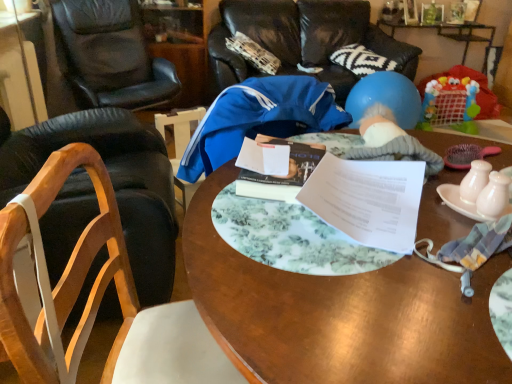
Question: Does wooden chair at left, the second chair in the front-to-back sequence, have a smaller size compared to blue fabric chair at upper center, the 4th chair from the front?

Choices:
 (A) yes
 (B) no

Answer: (A)

Question: Can blue fabric chair at upper center, the 4th chair from the front, be found inside wooden chair at left, the second chair in the front-to-back sequence?

Choices:
 (A) yes
 (B) no

Answer: (B)

Question: Is wooden chair at left, positioned as the 3th chair in back-to-front order, shorter than blue fabric chair at upper center, the 4th chair from the front?

Choices:
 (A) no
 (B) yes

Answer: (A)

Question: Does wooden chair at left, positioned as the 3th chair in back-to-front order, have a greater width compared to blue fabric chair at upper center, the 4th chair from the front?

Choices:
 (A) no
 (B) yes

Answer: (A)

Question: From the image's perspective, is wooden chair at left, the second chair in the front-to-back sequence, over blue fabric chair at upper center, the 4th chair from the front?

Choices:
 (A) no
 (B) yes

Answer: (A)

Question: Looking at the image, does white paper at center seem bigger or smaller compared to blue rubber ball at upper right?

Choices:
 (A) big
 (B) small

Answer: (B)

Question: Considering the positions of white paper at center and blue rubber ball at upper right in the image, is white paper at center taller or shorter than blue rubber ball at upper right?

Choices:
 (A) tall
 (B) short

Answer: (B)

Question: Is white paper at center in front of or behind blue rubber ball at upper right in the image?

Choices:
 (A) front
 (B) behind

Answer: (A)

Question: In terms of width, does white paper at center look wider or thinner when compared to blue rubber ball at upper right?

Choices:
 (A) thin
 (B) wide

Answer: (A)

Question: From a real-world perspective, is white paper at center positioned above or below blue fabric chair at upper center, the 4th chair from the front?

Choices:
 (A) below
 (B) above

Answer: (B)

Question: From the image's perspective, is white paper at center above or below blue fabric chair at upper center, arranged as the 1th chair when viewed from the back?

Choices:
 (A) above
 (B) below

Answer: (B)

Question: Considering their positions, is white paper at center located in front of or behind blue fabric chair at upper center, the 4th chair from the front?

Choices:
 (A) front
 (B) behind

Answer: (A)

Question: Looking at their shapes, would you say white paper at center is wider or thinner than blue fabric chair at upper center, arranged as the 1th chair when viewed from the back?

Choices:
 (A) wide
 (B) thin

Answer: (B)

Question: From the image's perspective, is blue rubber balloon at center located above or below blue rubber ball at upper right?

Choices:
 (A) above
 (B) below

Answer: (B)

Question: Is blue rubber balloon at center taller or shorter than blue rubber ball at upper right?

Choices:
 (A) tall
 (B) short

Answer: (B)